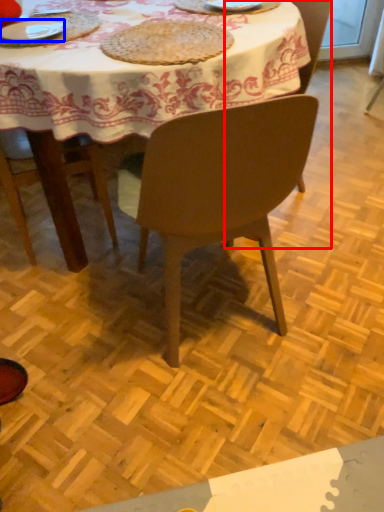
Question: Which of the following is the closest to the observer, chair (highlighted by a red box) or plate (highlighted by a blue box)?

Choices:
 (A) chair
 (B) plate

Answer: (B)